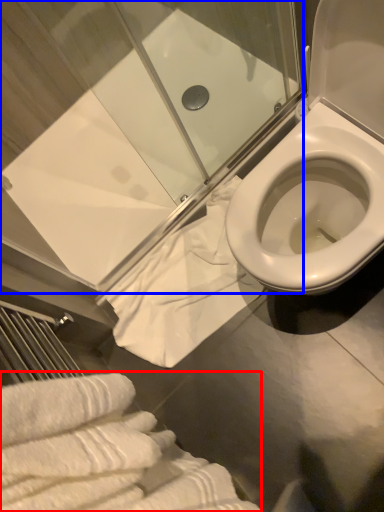
Question: Which object is closer to the camera taking this photo, bath towel (highlighted by a red box) or shower door (highlighted by a blue box)?

Choices:
 (A) bath towel
 (B) shower door

Answer: (A)